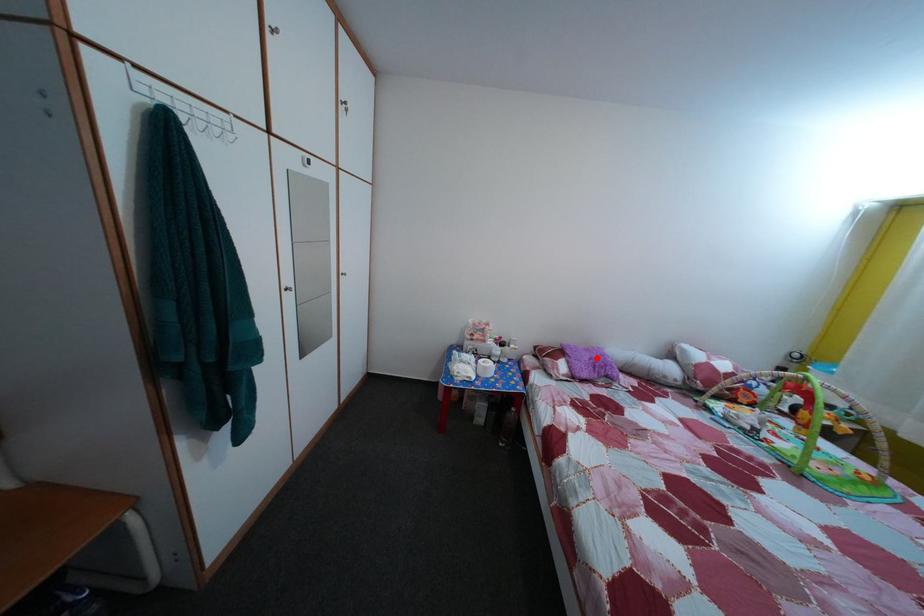
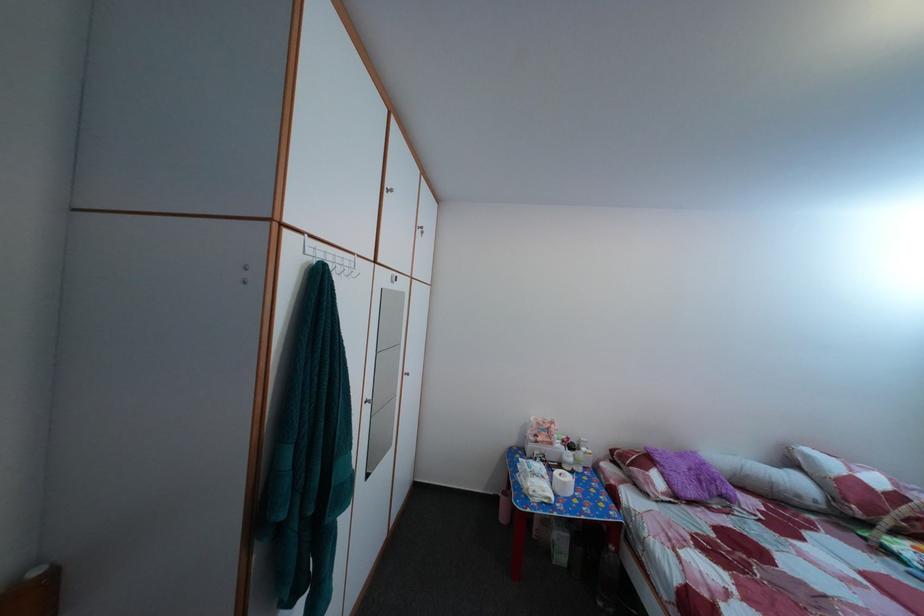
Where in the second image is the point corresponding to the highlighted location from the first image?

(689, 464)